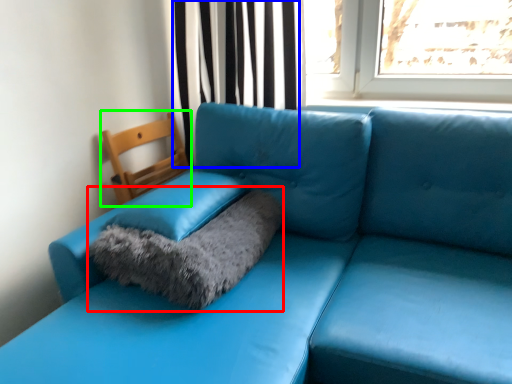
Question: Based on their relative distances, which object is nearer to cat bed (highlighted by a red box)? Choose from curtain (highlighted by a blue box) and armchair (highlighted by a green box).

Choices:
 (A) curtain
 (B) armchair

Answer: (B)